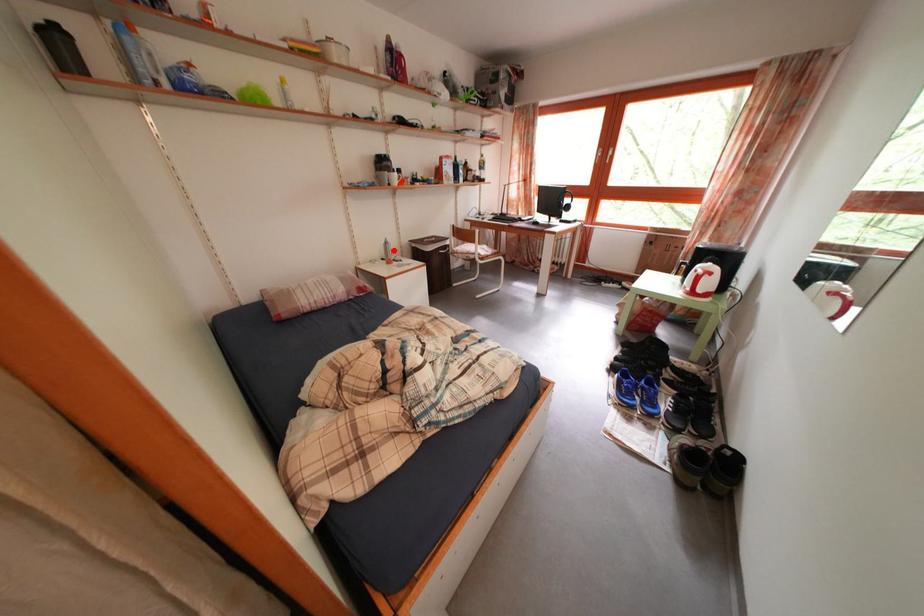
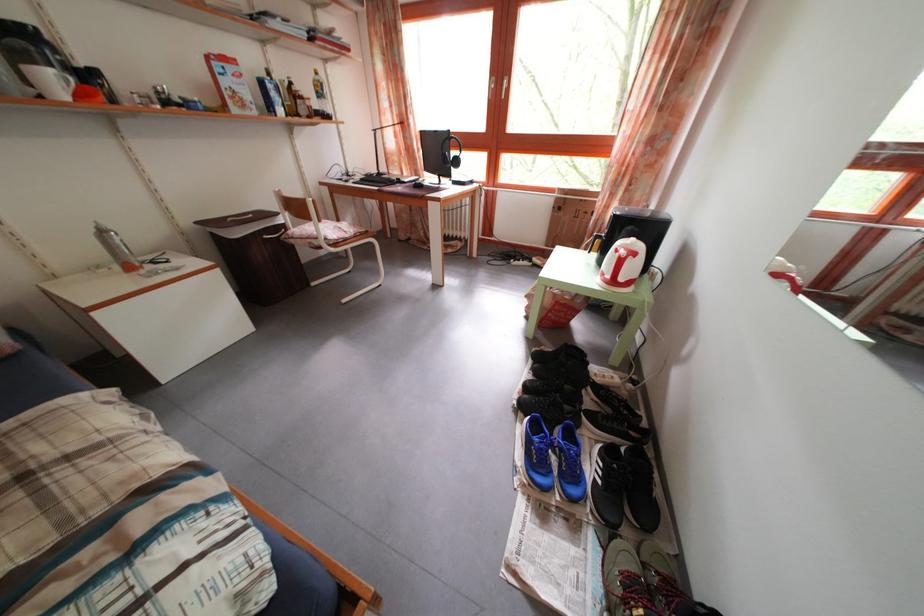
Question: I am providing you with two images of the same scene from different viewpoints. Image1 has a red point marked. In image2, the corresponding 3D location appears at what relative position? Reply with the corresponding letter.

Choices:
 (A) Closer
 (B) Farther

Answer: (B)